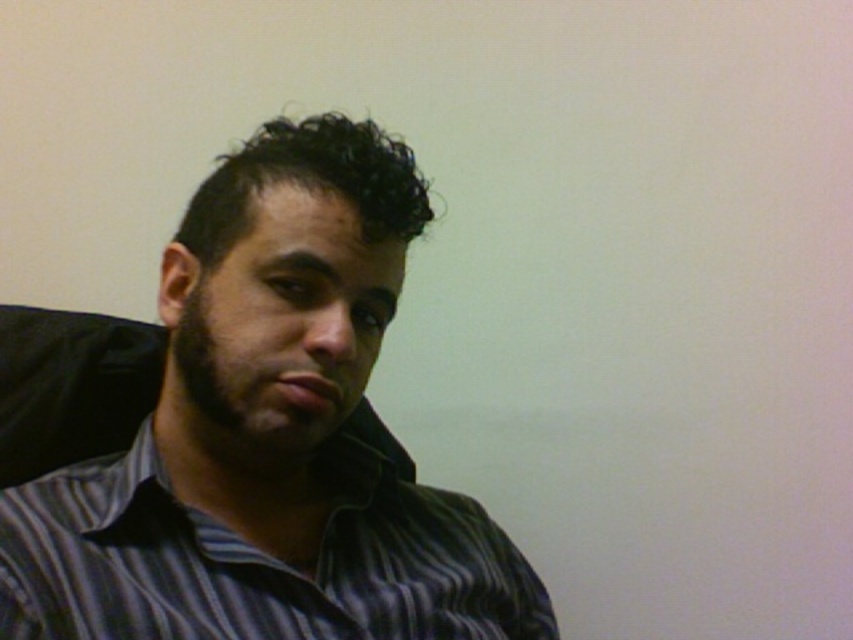
Question: Can you confirm if striped shirt at center is bigger than striped cotton shirt at center?

Choices:
 (A) yes
 (B) no

Answer: (A)

Question: Can you confirm if striped shirt at center is wider than striped cotton shirt at center?

Choices:
 (A) no
 (B) yes

Answer: (B)

Question: Is striped shirt at center below striped cotton shirt at center?

Choices:
 (A) yes
 (B) no

Answer: (B)

Question: Among these points, which one is farthest from the camera?

Choices:
 (A) (360, 129)
 (B) (30, 582)

Answer: (A)